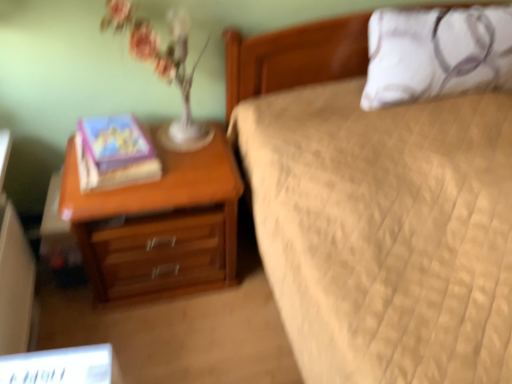
Image resolution: width=512 pixels, height=384 pixels. Find the location of `free area in between matte purple book at left and translucent glass vase at upper left`. free area in between matte purple book at left and translucent glass vase at upper left is located at coordinates (184, 155).